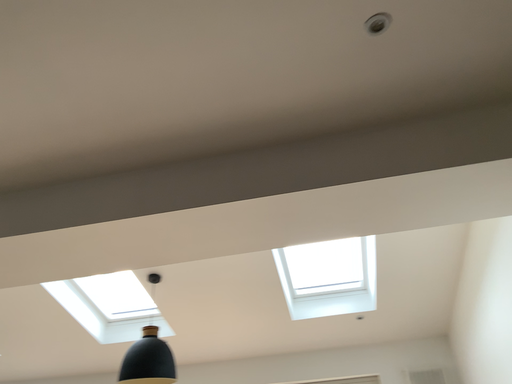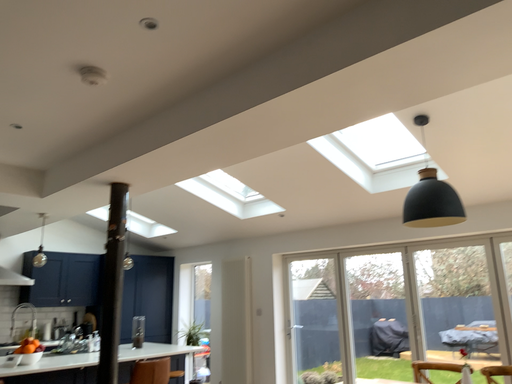
Question: Which way did the camera rotate in the video?

Choices:
 (A) rotated upward
 (B) rotated downward

Answer: (B)